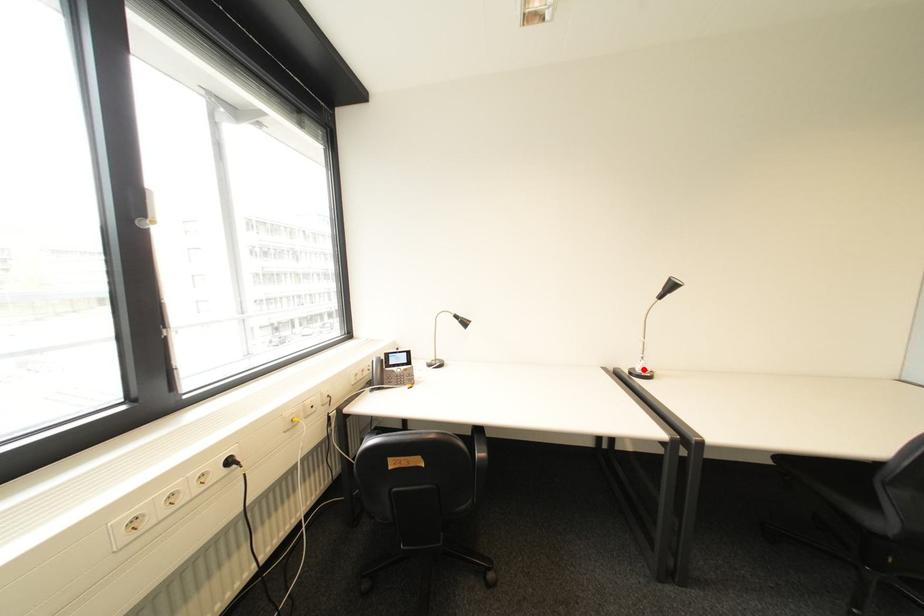
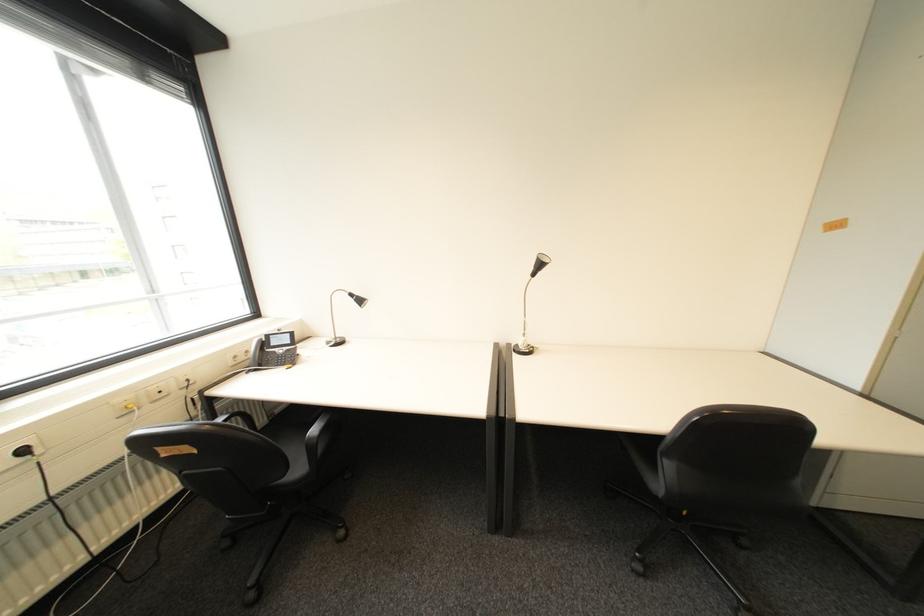
Where in the second image is the point corresponding to the highlighted location from the first image?

(528, 345)